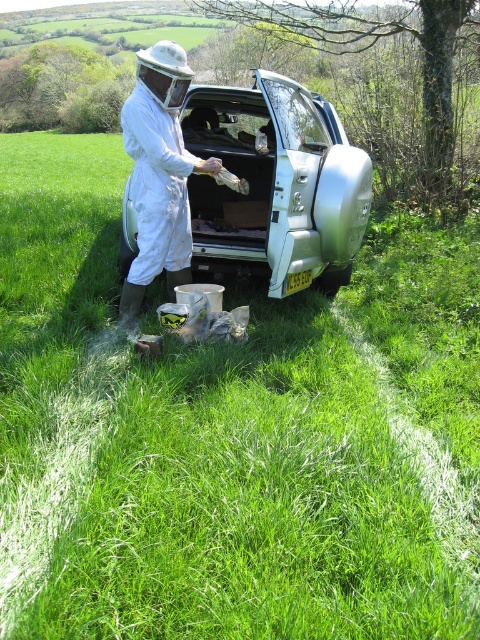
Based on the photo, who is more distant from viewer, (283, 282) or (154, 150)?

Point (283, 282)

Which of these two, silver metallic car at center or white fabric beekeeper suit at center, stands taller?

With more height is silver metallic car at center.

Which is behind, point (220, 262) or point (155, 230)?

Positioned behind is point (220, 262).

The image size is (480, 640). I want to click on silver metallic car at center, so click(x=276, y=184).

Does white fabric beekeeper at center appear on the left side of white fabric beekeeper suit at center?

Incorrect, white fabric beekeeper at center is not on the left side of white fabric beekeeper suit at center.

Between white fabric beekeeper at center and white fabric beekeeper suit at center, which one is positioned lower?

white fabric beekeeper at center

The height and width of the screenshot is (640, 480). Describe the element at coordinates (158, 176) in the screenshot. I see `white fabric beekeeper at center` at that location.

This screenshot has height=640, width=480. I want to click on white fabric beekeeper at center, so click(x=158, y=176).

Based on the photo, who is positioned more to the right, silver metallic car at center or white fabric beekeeper at center?

silver metallic car at center

Does silver metallic car at center have a smaller size compared to white fabric beekeeper at center?

Correct, silver metallic car at center occupies less space than white fabric beekeeper at center.

Identify the location of silver metallic car at center. (276, 184).

Find the location of a particular element. silver metallic car at center is located at coordinates (276, 184).